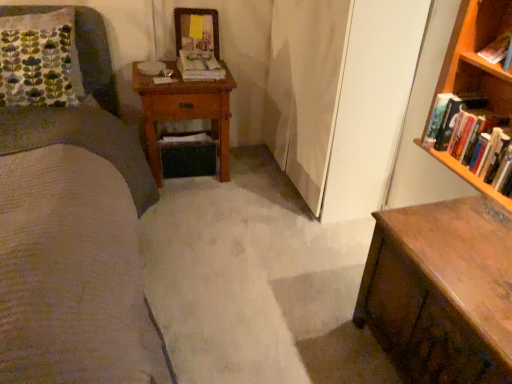
The image size is (512, 384). Find the location of `vacant space situated above wooden picture frame at upper center (from a real-world perspective)`. vacant space situated above wooden picture frame at upper center (from a real-world perspective) is located at coordinates (194, 10).